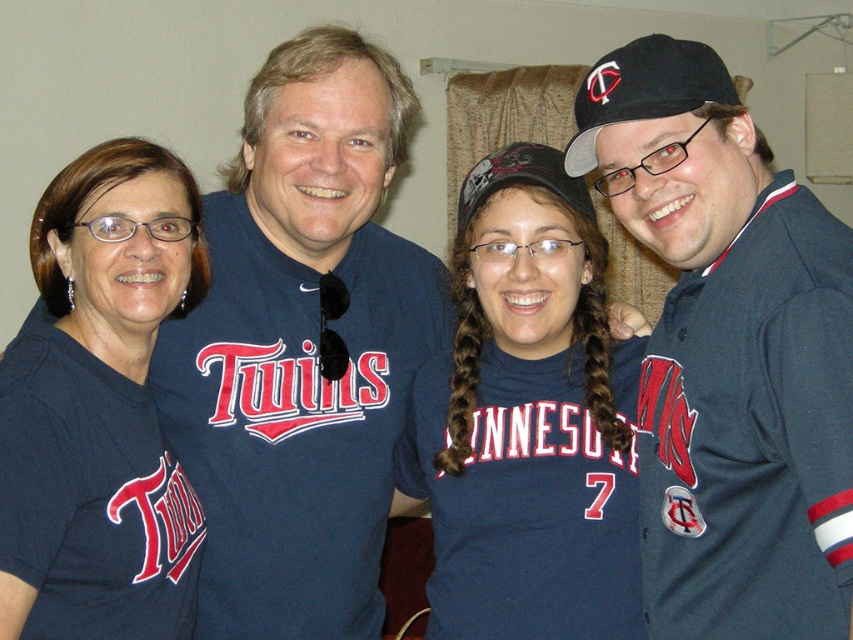
You are organizing a Twins fan event and need to display two jerseys on a wall. The blue jersey at right and the blue matte jersey at center must be hung side by side. Which jersey should be placed on the left to ensure the smaller one is not completely hidden by the larger one?

The blue jersey at right is smaller than the blue matte jersey at center, so placing the smaller blue jersey at right on the left side will prevent it from being hidden by the larger blue matte jersey at center.

You are trying to decide which item to wear for a Twins game. You have the blue jersey at right and the matte blue shirt at left. Based on the image, which one has a wider design?

The blue jersey at right is wider than the matte blue shirt at left according to the image description.